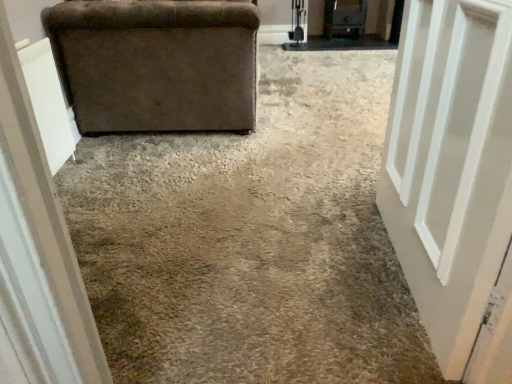
Question: Is brown fabric couch at upper left wider or thinner than white painted wood door at right?

Choices:
 (A) thin
 (B) wide

Answer: (B)

Question: Considering their positions, is brown fabric couch at upper left located in front of or behind white painted wood door at right?

Choices:
 (A) behind
 (B) front

Answer: (A)

Question: Which of these objects is positioned farthest from the white painted wood door at right?

Choices:
 (A) velvet brown armchair at left
 (B) brown fabric couch at upper left

Answer: (A)

Question: Based on their relative distances, which object is nearer to the velvet brown armchair at left?

Choices:
 (A) brown fabric couch at upper left
 (B) white painted wood door at right

Answer: (A)